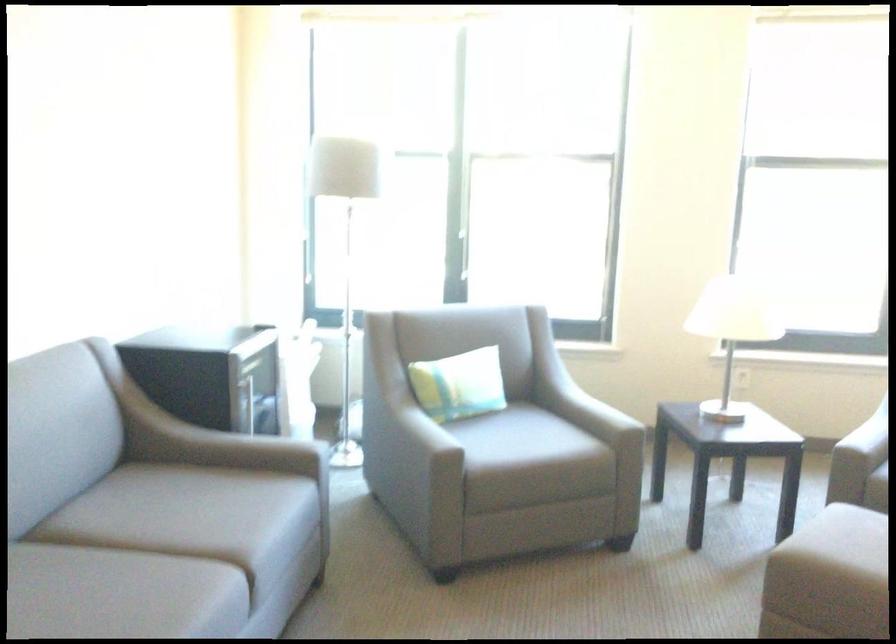
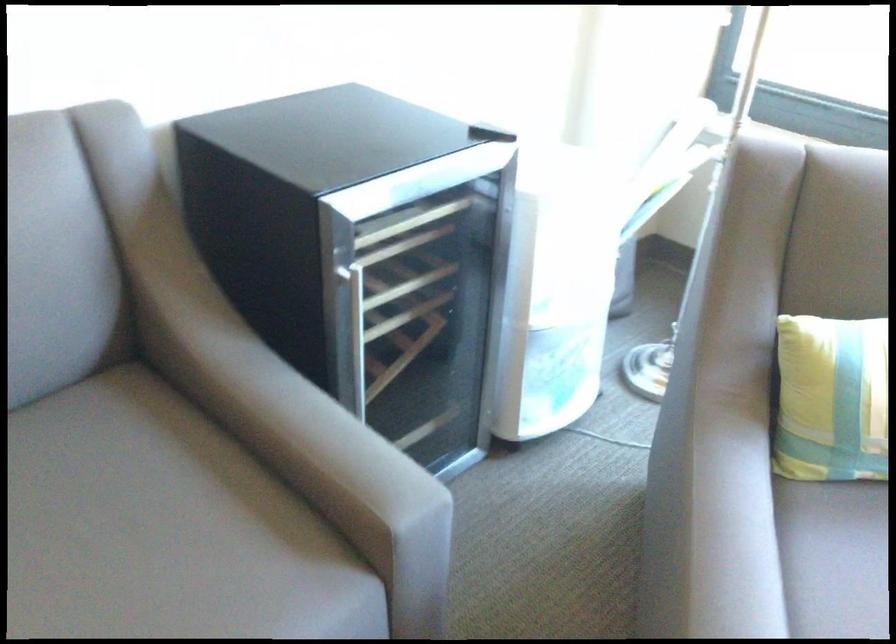
Locate, in the second image, the point that corresponds to point (424, 438) in the first image.

(837, 553)